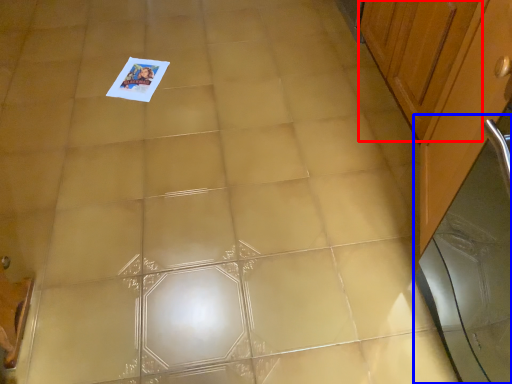
Question: Among these objects, which one is farthest to the camera, cabinetry (highlighted by a red box) or screen door (highlighted by a blue box)?

Choices:
 (A) cabinetry
 (B) screen door

Answer: (A)